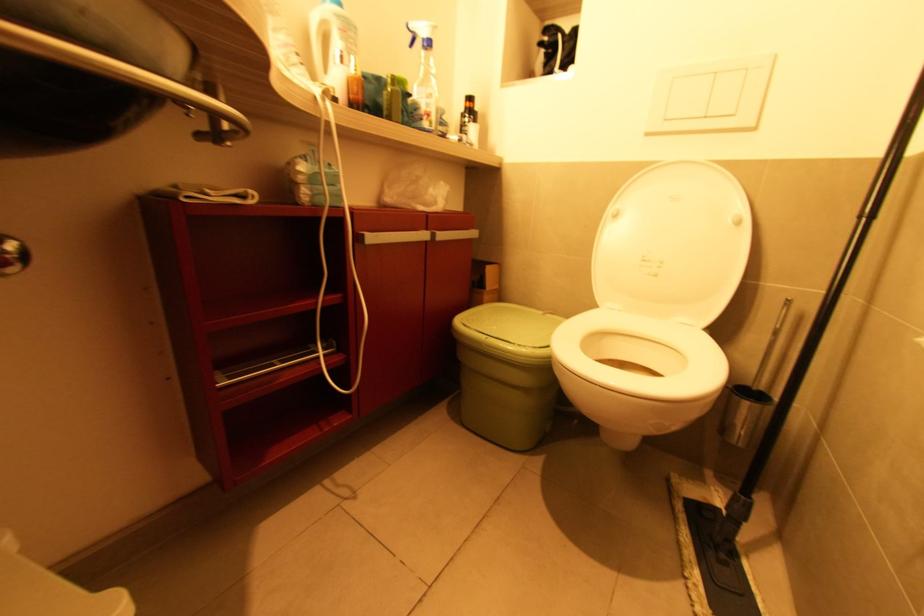
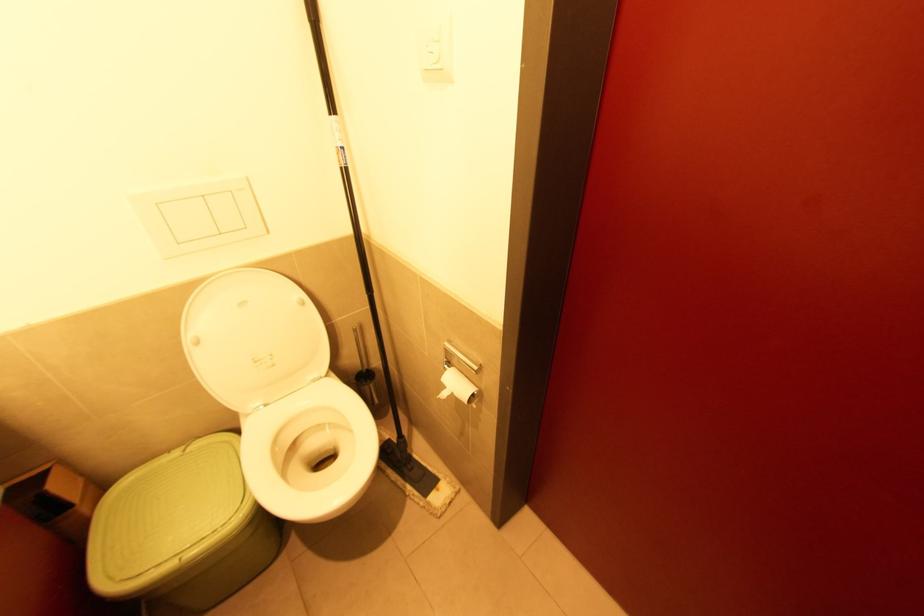
In the second image, find the point that corresponds to (x=545, y=314) in the first image.

(187, 452)